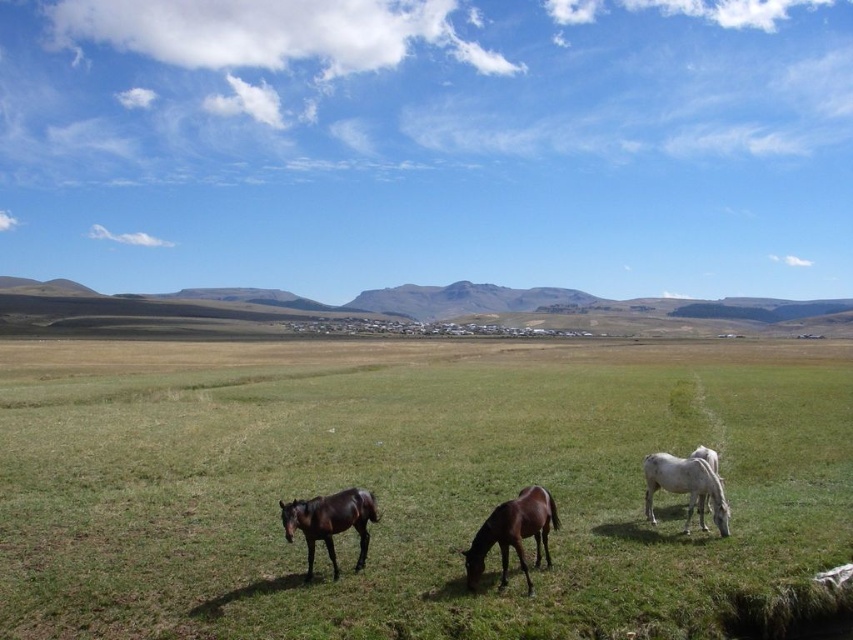
Which is behind, point (311, 556) or point (718, 524)?

Positioned behind is point (718, 524).

Who is positioned more to the left, shiny brown horse at lower left or white glossy horse at right?

shiny brown horse at lower left is more to the left.

Is point (376, 513) closer to viewer compared to point (688, 461)?

Yes.

Identify the location of shiny brown horse at lower left. Image resolution: width=853 pixels, height=640 pixels. (329, 522).

Which is above, brown glossy horse at center or shiny brown horse at lower left?

shiny brown horse at lower left is higher up.

Who is shorter, brown glossy horse at center or shiny brown horse at lower left?

shiny brown horse at lower left is shorter.

The width and height of the screenshot is (853, 640). What do you see at coordinates (514, 532) in the screenshot? I see `brown glossy horse at center` at bounding box center [514, 532].

This screenshot has width=853, height=640. I want to click on brown glossy horse at center, so click(514, 532).

Which is above, brown glossy horse at center or white glossy horse at right?

white glossy horse at right is above.

What do you see at coordinates (514, 532) in the screenshot? This screenshot has width=853, height=640. I see `brown glossy horse at center` at bounding box center [514, 532].

Between point (532, 493) and point (651, 483), which one is positioned behind?

The point (651, 483) is more distant.

The height and width of the screenshot is (640, 853). In order to click on brown glossy horse at center in this screenshot , I will do `click(514, 532)`.